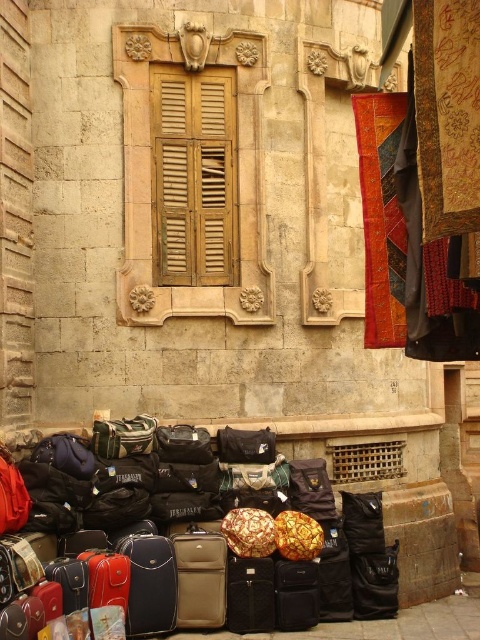
This screenshot has width=480, height=640. What do you see at coordinates (248, 570) in the screenshot?
I see `matte black suitcase at lower center` at bounding box center [248, 570].

Between matte black suitcase at lower center and matte black duffel bag at center, which one is positioned lower?

matte black suitcase at lower center is lower down.

Between point (278, 580) and point (249, 454), which one is positioned behind?

Point (249, 454)

Find the location of a particular element. Image resolution: width=480 pixels, height=640 pixels. matte black suitcase at lower center is located at coordinates (248, 570).

Does point (230, 202) come behind point (268, 449)?

Yes.

Who is taller, wooden at center or matte black duffel bag at center?

wooden at center

Between point (195, 81) and point (216, 435), which one is positioned in front?

Point (216, 435)

Where is `wooden at center`? The image size is (480, 640). wooden at center is located at coordinates (193, 176).

Can you confirm if matte black suitcase at lower center is shorter than wooden at center?

Yes.

Can you confirm if matte black suitcase at lower center is wider than wooden at center?

Correct, the width of matte black suitcase at lower center exceeds that of wooden at center.

Does point (159, 624) come closer to viewer compared to point (204, 228)?

Yes, point (159, 624) is in front of point (204, 228).

Locate an element on the screen. The height and width of the screenshot is (640, 480). matte black suitcase at lower center is located at coordinates (248, 570).